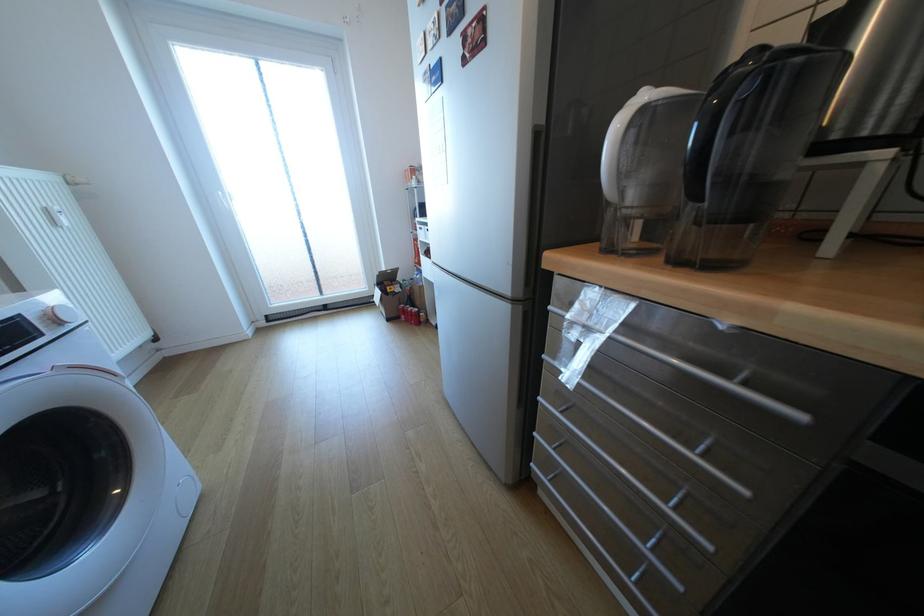
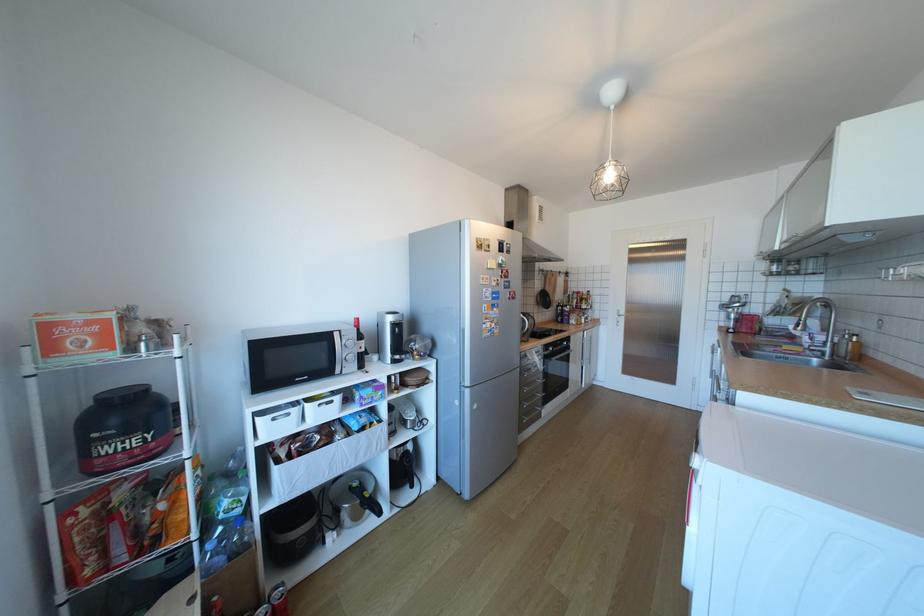
Locate, in the second image, the point that corresponds to (430,229) in the first image.

(283, 419)